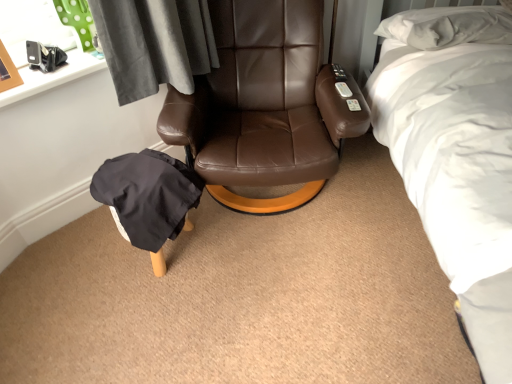
Question: Should I look upward or downward to see white soft bed at upper right?

Choices:
 (A) down
 (B) up

Answer: (B)

Question: Are black fabric bean bag chair at lower left and brown leather chair at center located far from each other?

Choices:
 (A) no
 (B) yes

Answer: (A)

Question: Is black fabric bean bag chair at lower left bigger than brown leather chair at center?

Choices:
 (A) no
 (B) yes

Answer: (A)

Question: Is black fabric bean bag chair at lower left completely or partially outside of brown leather chair at center?

Choices:
 (A) yes
 (B) no

Answer: (A)

Question: Is black fabric bean bag chair at lower left oriented away from brown leather chair at center?

Choices:
 (A) no
 (B) yes

Answer: (A)

Question: Is brown leather chair at center located within black fabric bean bag chair at lower left?

Choices:
 (A) no
 (B) yes

Answer: (A)

Question: From the image's perspective, is black fabric bean bag chair at lower left below brown leather chair at center?

Choices:
 (A) yes
 (B) no

Answer: (A)

Question: Is brown leather chair at center oriented away from black fabric bean bag chair at lower left?

Choices:
 (A) yes
 (B) no

Answer: (B)

Question: Does brown leather chair at center come behind black fabric bean bag chair at lower left?

Choices:
 (A) no
 (B) yes

Answer: (A)

Question: Could you tell me if brown leather chair at center is facing black fabric bean bag chair at lower left?

Choices:
 (A) no
 (B) yes

Answer: (A)

Question: Does brown leather chair at center appear on the right side of black fabric bean bag chair at lower left?

Choices:
 (A) yes
 (B) no

Answer: (A)

Question: Does brown leather chair at center have a greater width compared to black fabric bean bag chair at lower left?

Choices:
 (A) yes
 (B) no

Answer: (A)

Question: Considering the relative sizes of brown leather chair at center and black fabric bean bag chair at lower left in the image provided, is brown leather chair at center bigger than black fabric bean bag chair at lower left?

Choices:
 (A) no
 (B) yes

Answer: (B)

Question: Considering the relative sizes of white soft bed at upper right and black fabric bean bag chair at lower left in the image provided, is white soft bed at upper right thinner than black fabric bean bag chair at lower left?

Choices:
 (A) yes
 (B) no

Answer: (B)